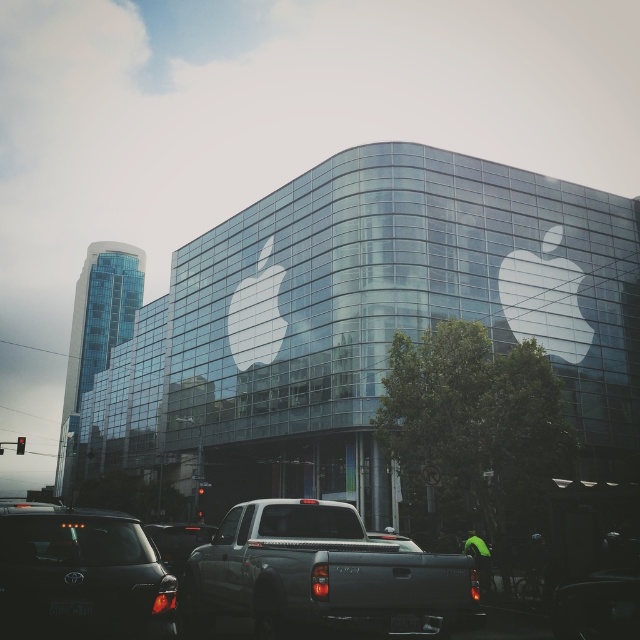
Question: Which of the following is the closest to the observer?

Choices:
 (A) matte gray pickup truck at center
 (B) matte black car at lower left

Answer: (B)

Question: Can you confirm if matte gray pickup truck at center is positioned below matte black car at lower left?

Choices:
 (A) no
 (B) yes

Answer: (B)

Question: Does matte gray pickup truck at center have a larger size compared to matte black car at lower left?

Choices:
 (A) yes
 (B) no

Answer: (A)

Question: In this image, where is matte gray pickup truck at center located relative to matte black car at lower left?

Choices:
 (A) right
 (B) left

Answer: (A)

Question: Which point is closer to the camera taking this photo?

Choices:
 (A) (128, 573)
 (B) (200, 636)

Answer: (A)